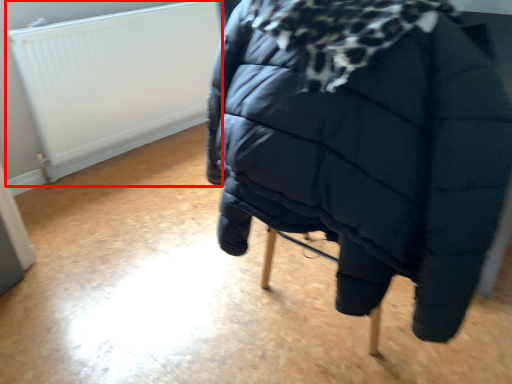
Question: From the image's perspective, where is radiator (annotated by the red box) located in relation to furniture in the image?

Choices:
 (A) below
 (B) above

Answer: (B)